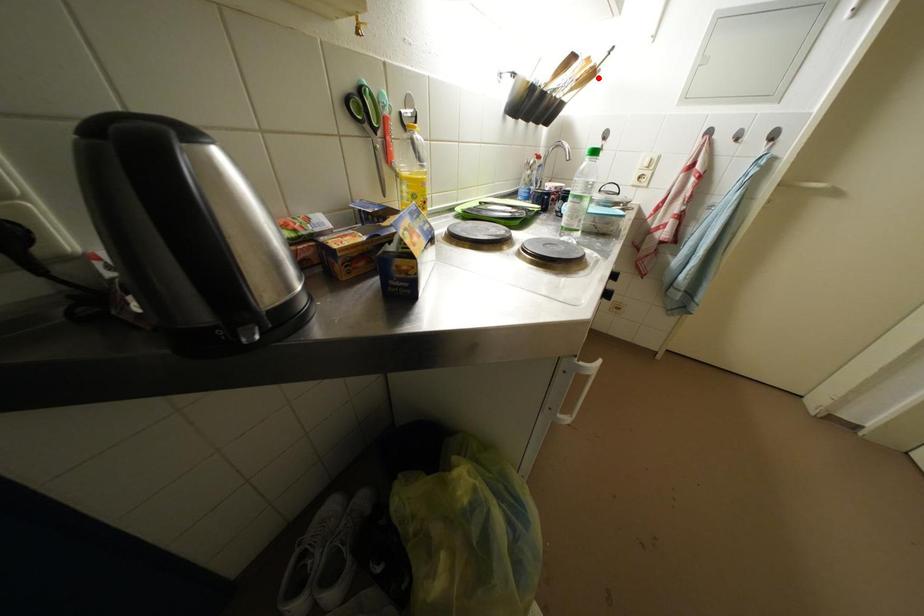
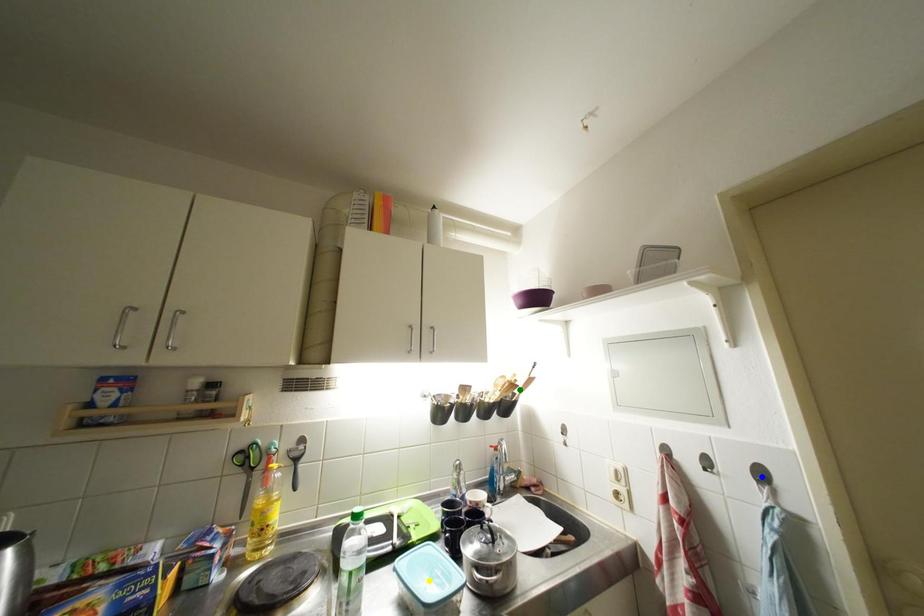
Question: I am providing you with two images of the same scene from different viewpoints. A red point is marked on the first image. You are given multiple points on the second image. Which point in image 2 represents the same 3d spot as the red point in image 1?

Choices:
 (A) blue point
 (B) yellow point
 (C) green point

Answer: (C)